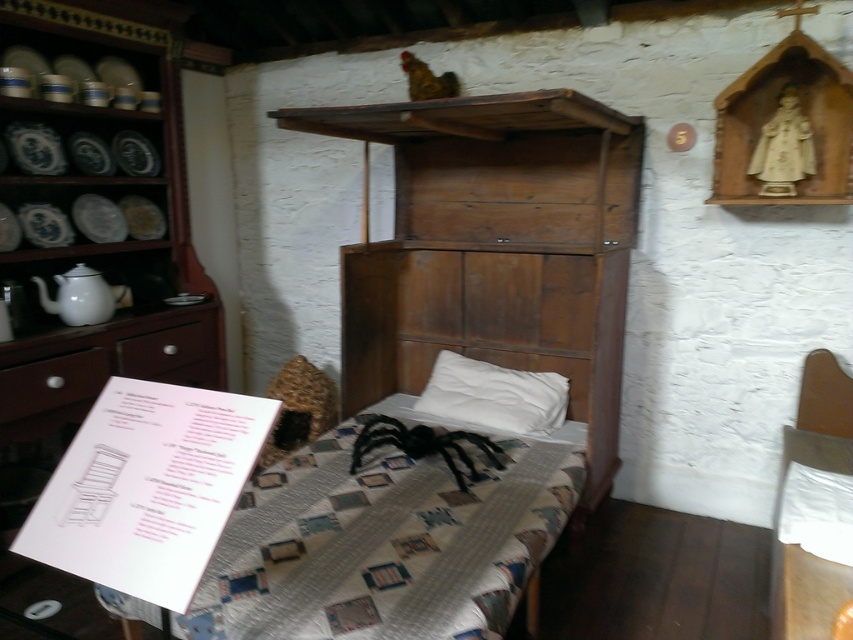
Image resolution: width=853 pixels, height=640 pixels. Find the location of `wooden chair at right`. wooden chair at right is located at coordinates (782, 493).

Consider the image. Can you confirm if wooden chair at right is wider than matte brown drawer at left?

Yes.

Who is more distant from viewer, (804,620) or (190,330)?

The point (190,330) is behind.

The height and width of the screenshot is (640, 853). I want to click on wooden chair at right, so coord(782,493).

Can you confirm if wooden dresser at left is bigger than wooden chair at right?

Yes, wooden dresser at left is bigger than wooden chair at right.

Is wooden dresser at left positioned before wooden chair at right?

That is False.

At what (x,y) coordinates should I click in order to perform the action: click on wooden dresser at left. Please return your answer as a coordinate pair (x, y). Looking at the image, I should click on (99, 196).

Is wooden dresser at left taller than white soft pillow at center?

Yes.

Is wooden dresser at left shorter than white soft pillow at center?

In fact, wooden dresser at left may be taller than white soft pillow at center.

Between point (38, 180) and point (483, 408), which one is positioned in front?

Point (38, 180) is more forward.

You are a GUI agent. You are given a task and a screenshot of the screen. Output one action in this format:
    pyautogui.click(x=<x>, y=<y>)
    Task: Click on the wooden dresser at left
    The image size is (853, 640).
    Given the screenshot: What is the action you would take?
    pyautogui.click(x=99, y=196)